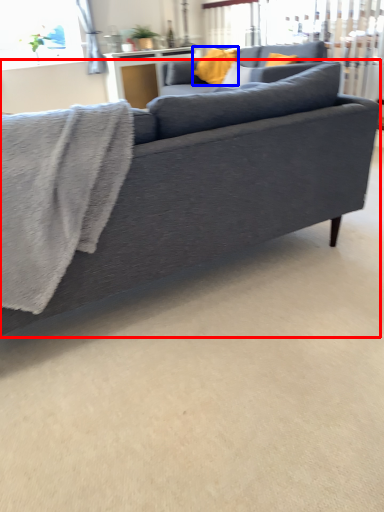
Question: Which object is further to the camera taking this photo, studio couch (highlighted by a red box) or pillow (highlighted by a blue box)?

Choices:
 (A) studio couch
 (B) pillow

Answer: (B)